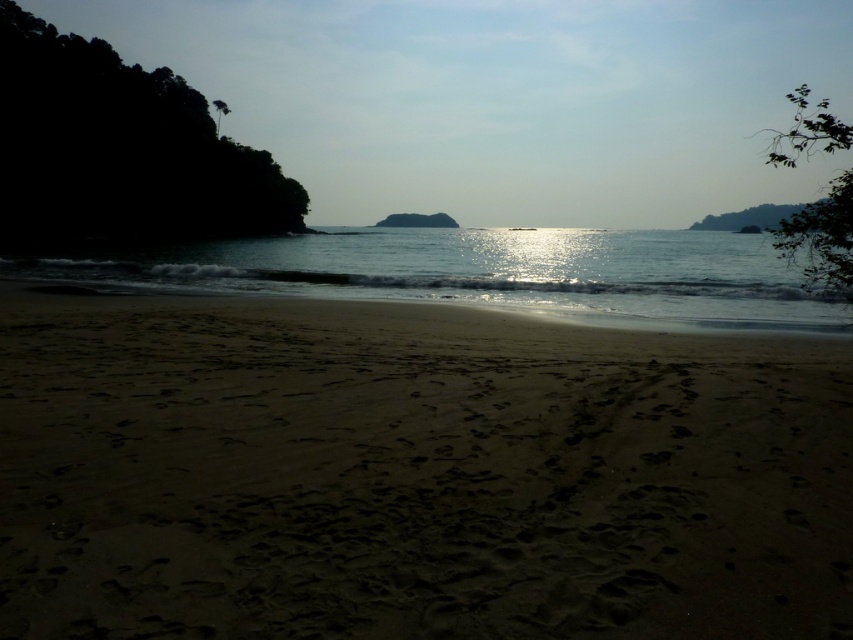
You are standing on the beach and want to walk from the light brown sand at center to the shiny reflective water at center. Which direction should you move to reach the water?

The light brown sand at center has a lesser width compared to shiny reflective water at center, so you should move towards the direction where the shiny reflective water at center is wider to reach the water.

You are standing on the beach and want to take a photo of both the light brown sand at center and the shiny reflective water at center. Which object will appear larger in the photo?

The light brown sand at center will appear larger in the photo because it is closer to the viewer than the shiny reflective water at center.

You are standing on the beach and notice the light brown sand at center and the shiny reflective water at center. Which one is positioned lower in the scene?

The light brown sand at center is located below the shiny reflective water at center, so it is positioned lower in the scene.